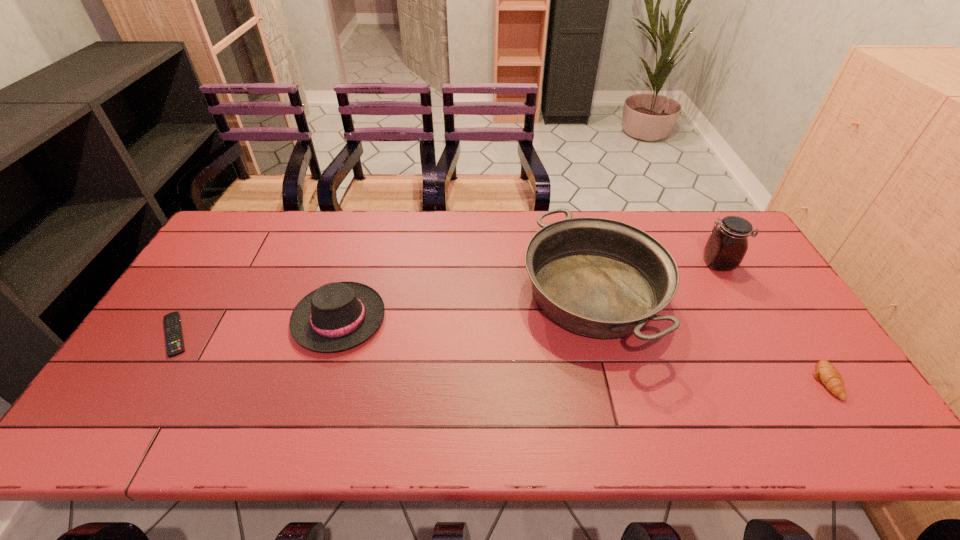
I want to click on vacant area that lies between the dress hat and the second shortest object, so click(583, 350).

Where is `empty space between the second shortest object and the second tallest object`? empty space between the second shortest object and the second tallest object is located at coordinates point(709,338).

Locate an element on the screen. vacant area that lies between the rightmost object and the second object from left to right is located at coordinates (583, 350).

Find the location of a particular element. The image size is (960, 540). free space between the jar and the dress hat is located at coordinates (529, 291).

Image resolution: width=960 pixels, height=540 pixels. Find the location of `vacant area between the shortest object and the dress hat`. vacant area between the shortest object and the dress hat is located at coordinates (257, 327).

I want to click on object that is the second closest to the dress hat, so click(x=597, y=277).

Locate an element on the screen. object that is the third closest to the fourth tallest object is located at coordinates (337, 316).

The width and height of the screenshot is (960, 540). Identify the location of free space that satisfies the following two spatial constraints: 1. on the lid of the second object from right to left; 2. on the left side of the rightmost object. (785, 381).

You are a GUI agent. You are given a task and a screenshot of the screen. Output one action in this format:
    pyautogui.click(x=<x>, y=<y>)
    Task: Click on the vacant space that satisfies the following two spatial constraints: 1. on the lid of the jar; 2. on the right side of the second shortest object
    
    Given the screenshot: What is the action you would take?
    pyautogui.click(x=785, y=381)

Where is `blank area in the image that satisfies the following two spatial constraints: 1. on the back side of the second object from left to right; 2. on the right side of the second tallest object`? blank area in the image that satisfies the following two spatial constraints: 1. on the back side of the second object from left to right; 2. on the right side of the second tallest object is located at coordinates (347, 295).